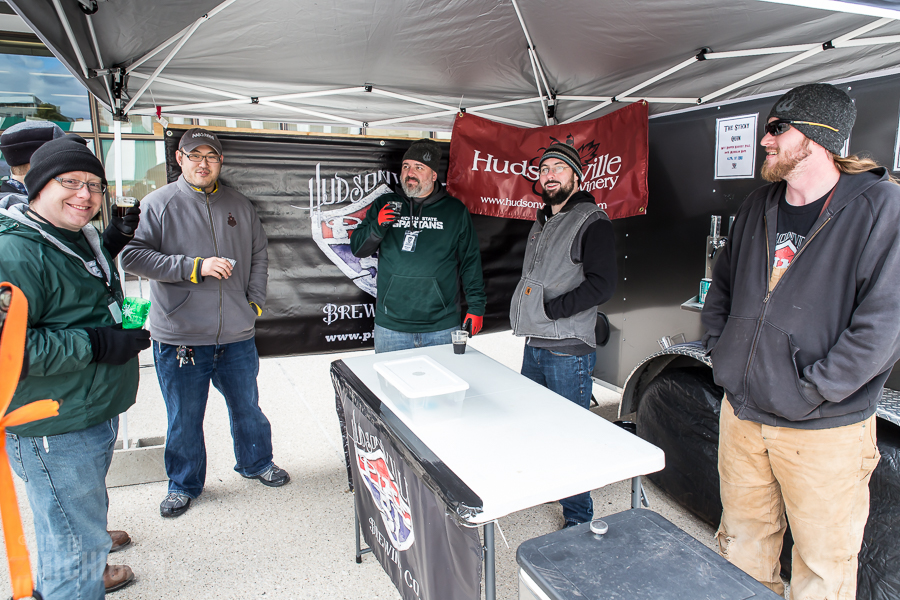
I want to click on ceiling, so pyautogui.click(x=347, y=102).